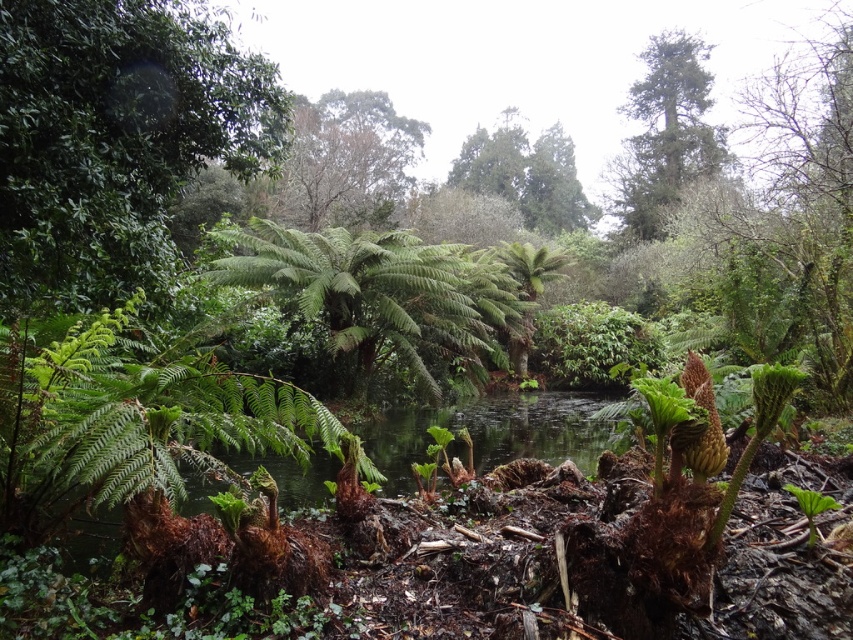
In the scene shown: You are standing in the forest and want to take a photo of both the green glossy leafy tree at upper left and the green textured tree at upper right. Which tree should you position to your left to include both in the frame?

You should position the green glossy leafy tree at upper left to your left since it is already to the left of the green textured tree at upper right, allowing both to be captured in the photo frame.